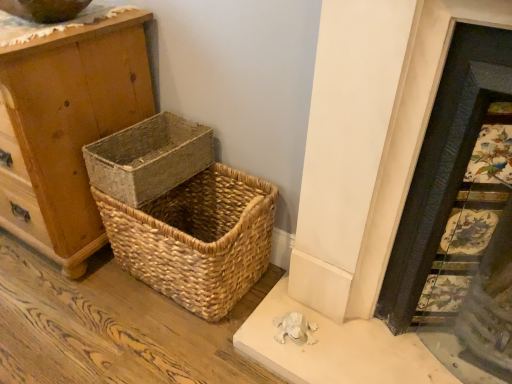
Describe the element at coordinates (434, 179) in the screenshot. I see `decorative tile fireplace at right` at that location.

I want to click on natural woven picnic basket at lower left, the 2th picnic basket viewed from the top, so click(197, 238).

Identify the location of wooden chest of drawers at left. (66, 128).

Is natural woven basket at center, the 1th picnic basket positioned from the top, not inside wooden chest of drawers at left?

Yes, natural woven basket at center, the 1th picnic basket positioned from the top, is located beyond the bounds of wooden chest of drawers at left.

Which object is thinner, natural woven basket at center, the 1th picnic basket positioned from the top, or wooden chest of drawers at left?

Thinner between the two is natural woven basket at center, the 1th picnic basket positioned from the top.

Is natural woven basket at center, the 1th picnic basket positioned from the top, beside wooden chest of drawers at left?

natural woven basket at center, the 1th picnic basket positioned from the top, and wooden chest of drawers at left are clearly separated.

Which is in front, point (189, 161) or point (7, 209)?

The point (189, 161) is closer.

Which is closer to the camera, (162, 132) or (255, 196)?

The point (255, 196) is closer.

Is natural woven picnic basket at lower left, marked as the 1th picnic basket in a bottom-to-top arrangement, completely or partially inside natural woven basket at center, the 1th picnic basket positioned from the top?

No, natural woven picnic basket at lower left, marked as the 1th picnic basket in a bottom-to-top arrangement, is not inside natural woven basket at center, the 1th picnic basket positioned from the top.

I want to click on picnic basket that is on the left side of natural woven picnic basket at lower left, the 2th picnic basket viewed from the top, so click(x=148, y=158).

Considering the relative sizes of natural woven basket at center, which is the second picnic basket in bottom-to-top order, and natural woven picnic basket at lower left, marked as the 1th picnic basket in a bottom-to-top arrangement, in the image provided, is natural woven basket at center, which is the second picnic basket in bottom-to-top order, shorter than natural woven picnic basket at lower left, marked as the 1th picnic basket in a bottom-to-top arrangement,?

Yes, natural woven basket at center, which is the second picnic basket in bottom-to-top order, is shorter than natural woven picnic basket at lower left, marked as the 1th picnic basket in a bottom-to-top arrangement.

From the image's perspective, does decorative tile fireplace at right appear lower than natural woven basket at center, the 1th picnic basket positioned from the top?

Yes.

Which is correct: decorative tile fireplace at right is inside natural woven basket at center, which is the second picnic basket in bottom-to-top order, or outside of it?

decorative tile fireplace at right is not inside natural woven basket at center, which is the second picnic basket in bottom-to-top order, it's outside.

Is decorative tile fireplace at right bigger than natural woven basket at center, the 1th picnic basket positioned from the top?

Yes.

Is wooden chest of drawers at left not near natural woven picnic basket at lower left, marked as the 1th picnic basket in a bottom-to-top arrangement?

No, there isn't a large distance between wooden chest of drawers at left and natural woven picnic basket at lower left, marked as the 1th picnic basket in a bottom-to-top arrangement.

Looking at this image, is wooden chest of drawers at left taller or shorter than natural woven picnic basket at lower left, marked as the 1th picnic basket in a bottom-to-top arrangement?

In the image, wooden chest of drawers at left appears to be taller than natural woven picnic basket at lower left, marked as the 1th picnic basket in a bottom-to-top arrangement.

Is wooden chest of drawers at left located outside natural woven picnic basket at lower left, the 2th picnic basket viewed from the top?

Yes.

Is wooden chest of drawers at left facing away from natural woven picnic basket at lower left, marked as the 1th picnic basket in a bottom-to-top arrangement?

wooden chest of drawers at left is not turned away from natural woven picnic basket at lower left, marked as the 1th picnic basket in a bottom-to-top arrangement.

From the image's perspective, which object appears higher, wooden chest of drawers at left or decorative tile fireplace at right?

wooden chest of drawers at left is shown above in the image.

Which object is thinner, wooden chest of drawers at left or decorative tile fireplace at right?

With smaller width is decorative tile fireplace at right.

Looking at this image, is the depth of wooden chest of drawers at left less than that of decorative tile fireplace at right?

No, wooden chest of drawers at left is further to the viewer.

The width and height of the screenshot is (512, 384). Identify the location of fireplace positioned vertically above the wooden chest of drawers at left (from a real-world perspective). (434, 179).

Could you tell me if decorative tile fireplace at right is facing wooden chest of drawers at left?

No, decorative tile fireplace at right does not turn towards wooden chest of drawers at left.

Does point (420, 282) come in front of point (42, 217)?

Yes, point (420, 282) is in front of point (42, 217).

Can we say decorative tile fireplace at right lies outside wooden chest of drawers at left?

decorative tile fireplace at right lies outside wooden chest of drawers at left's area.

From a real-world perspective, who is located higher, decorative tile fireplace at right or wooden chest of drawers at left?

decorative tile fireplace at right is physically above.

Is natural woven basket at center, which is the second picnic basket in bottom-to-top order, inside natural woven picnic basket at lower left, the 2th picnic basket viewed from the top?

Yes, natural woven basket at center, which is the second picnic basket in bottom-to-top order, is inside natural woven picnic basket at lower left, the 2th picnic basket viewed from the top.

Considering the sizes of objects natural woven picnic basket at lower left, marked as the 1th picnic basket in a bottom-to-top arrangement, and natural woven basket at center, the 1th picnic basket positioned from the top, in the image provided, who is shorter, natural woven picnic basket at lower left, marked as the 1th picnic basket in a bottom-to-top arrangement, or natural woven basket at center, the 1th picnic basket positioned from the top,?

Standing shorter between the two is natural woven basket at center, the 1th picnic basket positioned from the top.

Is natural woven picnic basket at lower left, marked as the 1th picnic basket in a bottom-to-top arrangement, bigger than natural woven basket at center, the 1th picnic basket positioned from the top?

Correct, natural woven picnic basket at lower left, marked as the 1th picnic basket in a bottom-to-top arrangement, is larger in size than natural woven basket at center, the 1th picnic basket positioned from the top.

Find the location of a particular element. The width and height of the screenshot is (512, 384). the 1st picnic basket positioned below the wooden chest of drawers at left (from the image's perspective) is located at coordinates (148, 158).

Image resolution: width=512 pixels, height=384 pixels. What are the coordinates of `picnic basket above the natural woven picnic basket at lower left, the 2th picnic basket viewed from the top (from a real-world perspective)` in the screenshot? It's located at (148, 158).

Estimate the real-world distances between objects in this image. Which object is closer to decorative tile fireplace at right, wooden chest of drawers at left or natural woven picnic basket at lower left, marked as the 1th picnic basket in a bottom-to-top arrangement?

natural woven picnic basket at lower left, marked as the 1th picnic basket in a bottom-to-top arrangement.

Looking at this image, estimate the real-world distances between objects in this image. Which object is closer to wooden chest of drawers at left, natural woven basket at center, which is the second picnic basket in bottom-to-top order, or natural woven picnic basket at lower left, marked as the 1th picnic basket in a bottom-to-top arrangement?

natural woven basket at center, which is the second picnic basket in bottom-to-top order.

Looking at the image, which one is located further to natural woven basket at center, which is the second picnic basket in bottom-to-top order, decorative tile fireplace at right or natural woven picnic basket at lower left, marked as the 1th picnic basket in a bottom-to-top arrangement?

decorative tile fireplace at right is positioned further to the anchor natural woven basket at center, which is the second picnic basket in bottom-to-top order.

Estimate the real-world distances between objects in this image. Which object is further from natural woven picnic basket at lower left, marked as the 1th picnic basket in a bottom-to-top arrangement, decorative tile fireplace at right or wooden chest of drawers at left?

Based on the image, decorative tile fireplace at right appears to be further to natural woven picnic basket at lower left, marked as the 1th picnic basket in a bottom-to-top arrangement.

In the scene shown: When comparing their distances from decorative tile fireplace at right, does natural woven basket at center, which is the second picnic basket in bottom-to-top order, or natural woven picnic basket at lower left, the 2th picnic basket viewed from the top, seem closer?

natural woven picnic basket at lower left, the 2th picnic basket viewed from the top, lies closer to decorative tile fireplace at right than the other object.

From the image, which object appears to be nearer to natural woven picnic basket at lower left, the 2th picnic basket viewed from the top, natural woven basket at center, the 1th picnic basket positioned from the top, or wooden chest of drawers at left?

Based on the image, natural woven basket at center, the 1th picnic basket positioned from the top, appears to be nearer to natural woven picnic basket at lower left, the 2th picnic basket viewed from the top.

Based on their spatial positions, is natural woven picnic basket at lower left, marked as the 1th picnic basket in a bottom-to-top arrangement, or decorative tile fireplace at right closer to wooden chest of drawers at left?

Based on the image, natural woven picnic basket at lower left, marked as the 1th picnic basket in a bottom-to-top arrangement, appears to be nearer to wooden chest of drawers at left.

Based on their spatial positions, is decorative tile fireplace at right or natural woven basket at center, the 1th picnic basket positioned from the top, further from wooden chest of drawers at left?

Among the two, decorative tile fireplace at right is located further to wooden chest of drawers at left.

I want to click on picnic basket between natural woven basket at center, the 1th picnic basket positioned from the top, and decorative tile fireplace at right, so click(x=197, y=238).

Where is `picnic basket between wooden chest of drawers at left and natural woven picnic basket at lower left, marked as the 1th picnic basket in a bottom-to-top arrangement`? The width and height of the screenshot is (512, 384). picnic basket between wooden chest of drawers at left and natural woven picnic basket at lower left, marked as the 1th picnic basket in a bottom-to-top arrangement is located at coordinates (148, 158).